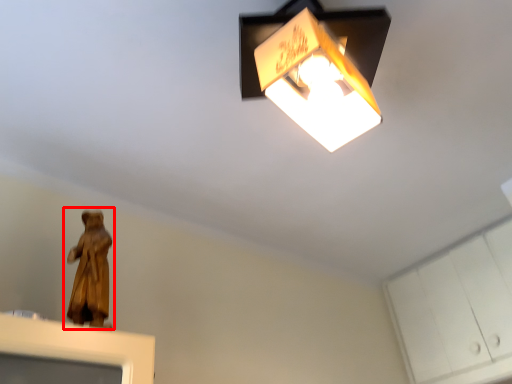
Question: From the image's perspective, what is the correct spatial relationship of person (annotated by the red box) in relation to cabinetry?

Choices:
 (A) below
 (B) above

Answer: (B)